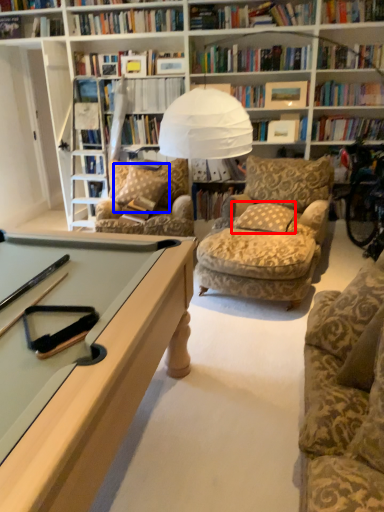
Question: Which object is closer to the camera taking this photo, pillow (highlighted by a red box) or pillow (highlighted by a blue box)?

Choices:
 (A) pillow
 (B) pillow

Answer: (A)